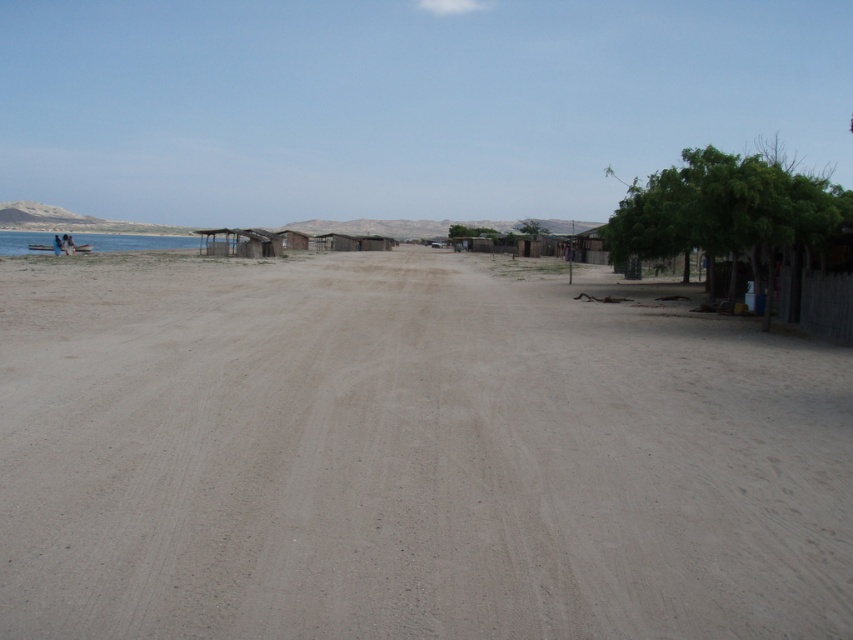
Question: Observing the image, what is the correct spatial positioning of dull brown dirt field at center in reference to blue water at left?

Choices:
 (A) above
 (B) below

Answer: (B)

Question: Observing the image, what is the correct spatial positioning of dull brown dirt field at center in reference to blue water at left?

Choices:
 (A) below
 (B) above

Answer: (A)

Question: Does dull brown dirt field at center come behind blue water at left?

Choices:
 (A) yes
 (B) no

Answer: (B)